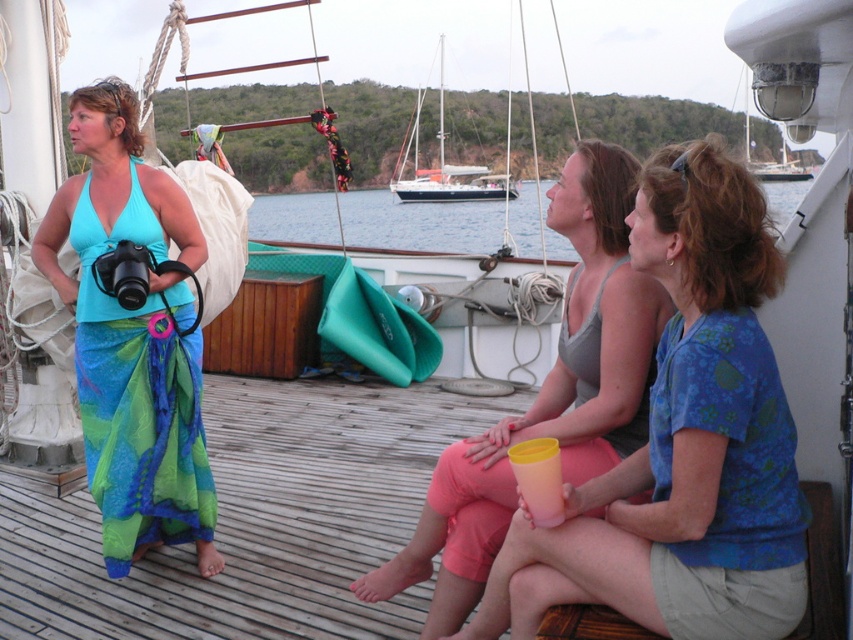
Can you confirm if matte blue shirt at center is positioned to the left of white sailboat at center?

Yes, matte blue shirt at center is to the left of white sailboat at center.

Is point (706, 160) behind point (415, 179)?

No.

Locate an element on the screen. The height and width of the screenshot is (640, 853). matte blue shirt at center is located at coordinates point(683,442).

Who is taller, matte gray tank top at center or white sailboat at center?

matte gray tank top at center

Between point (610, 355) and point (415, 189), which one is positioned behind?

The point (415, 189) is behind.

Where is `matte gray tank top at center`? The height and width of the screenshot is (640, 853). matte gray tank top at center is located at coordinates (546, 396).

Identify the location of teal silk halter top at left. (132, 339).

Describe the element at coordinates (132, 339) in the screenshot. I see `teal silk halter top at left` at that location.

Image resolution: width=853 pixels, height=640 pixels. Find the location of `teal silk halter top at left`. teal silk halter top at left is located at coordinates (132, 339).